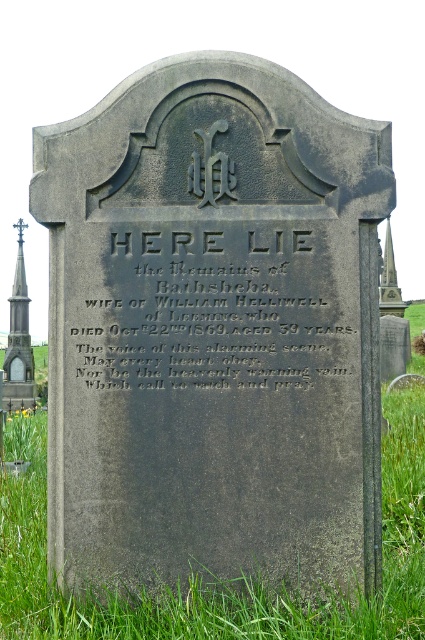
Based on the scene described, which object is closer to the viewer between the green grass at lower center and the polished stone spire at left?

The green grass at lower center is closer to the viewer as it is positioned in front of the polished stone spire at left.

You are a photographer standing at the base of the gravestone. You want to capture both the green grass at lower center and the stone spire at right in your photo. Which object will appear larger in the final image?

The green grass at lower center will appear larger in the final image because it is larger in size than the stone spire at right.